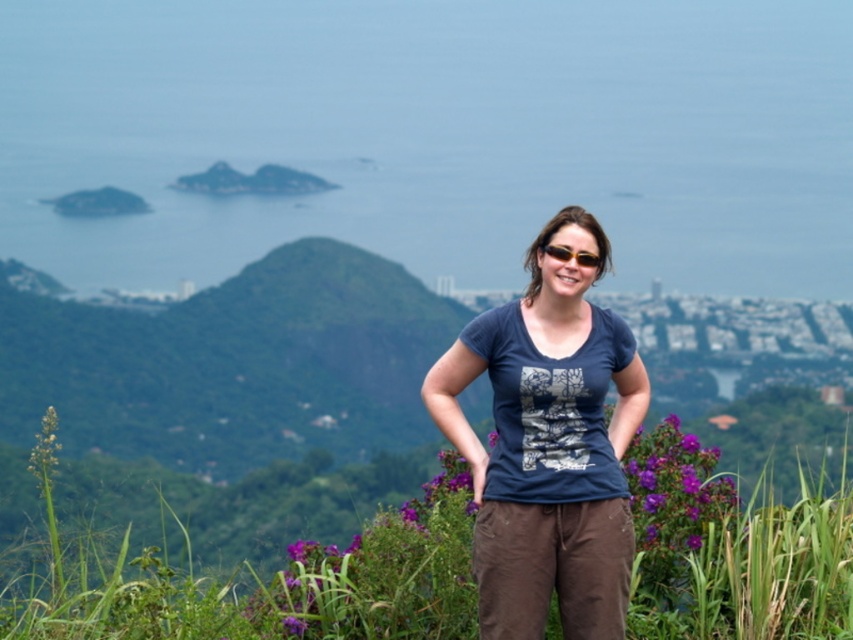
Between point (527, 289) and point (694, 456), which one is positioned in front?

Positioned in front is point (527, 289).

Is blue cotton t-shirt at center positioned in front of purple matte flower at center?

Yes, blue cotton t-shirt at center is closer to the viewer.

Is point (582, 230) positioned behind point (698, 440)?

No, (582, 230) is in front of (698, 440).

Where is `blue cotton t-shirt at center`? blue cotton t-shirt at center is located at coordinates (548, 444).

Is point (474, 547) positioned behind point (552, 244)?

Yes, point (474, 547) is behind point (552, 244).

Is blue cotton t-shirt at center above sunglasses at center?

Actually, blue cotton t-shirt at center is below sunglasses at center.

Where is `blue cotton t-shirt at center`? The height and width of the screenshot is (640, 853). blue cotton t-shirt at center is located at coordinates (548, 444).

Between purple matte flower at center and sunglasses at center, which one appears on the left side from the viewer's perspective?

From the viewer's perspective, sunglasses at center appears more on the left side.

Can you confirm if purple matte flower at center is thinner than sunglasses at center?

No, purple matte flower at center is not thinner than sunglasses at center.

Where is `purple matte flower at center`? purple matte flower at center is located at coordinates (672, 490).